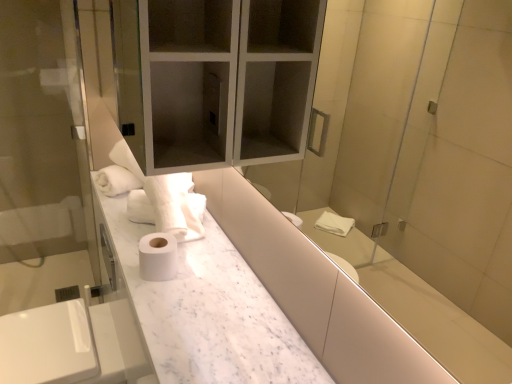
Where is `vacant area that is in front of white matte toilet paper at center`? Image resolution: width=512 pixels, height=384 pixels. vacant area that is in front of white matte toilet paper at center is located at coordinates [x=159, y=305].